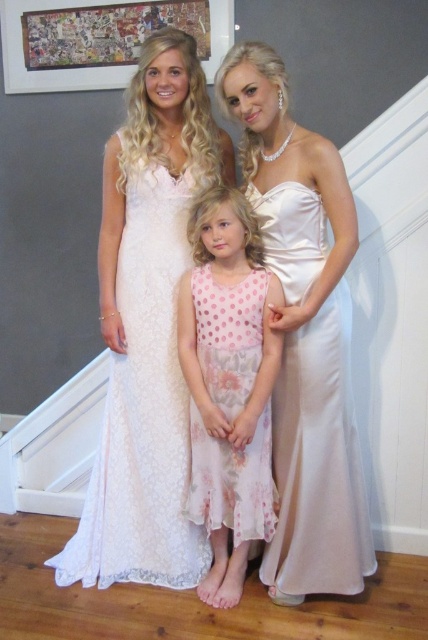
Can you confirm if lace fabric dress at center is positioned above pink floral dress at center?

Correct, lace fabric dress at center is located above pink floral dress at center.

Is point (171, 86) farther from viewer compared to point (225, 417)?

Yes, point (171, 86) is behind point (225, 417).

Image resolution: width=428 pixels, height=640 pixels. What are the coordinates of `lace fabric dress at center` in the screenshot? It's located at (146, 326).

Is lace fabric dress at center wider than satin dress at center?

Indeed, lace fabric dress at center has a greater width compared to satin dress at center.

Does lace fabric dress at center appear under satin dress at center?

No.

Is point (154, 387) positioned after point (278, 241)?

Yes.

Where is `lace fabric dress at center`? Image resolution: width=428 pixels, height=640 pixels. lace fabric dress at center is located at coordinates (146, 326).

Who is shorter, satin dress at center or pink floral dress at center?

With less height is satin dress at center.

Does satin dress at center have a smaller size compared to pink floral dress at center?

No.

You are a GUI agent. You are given a task and a screenshot of the screen. Output one action in this format:
    pyautogui.click(x=<x>, y=<y>)
    Task: Click on the satin dress at center
    
    Given the screenshot: What is the action you would take?
    pyautogui.click(x=318, y=461)